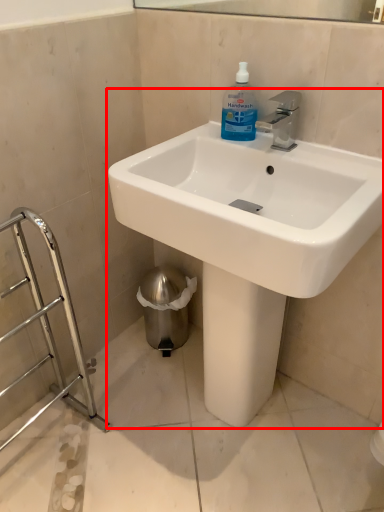
Question: From the image's perspective, considering the relative positions of sink (annotated by the red box) and cleaning product in the image provided, where is sink (annotated by the red box) located with respect to the staircase?

Choices:
 (A) below
 (B) above

Answer: (A)